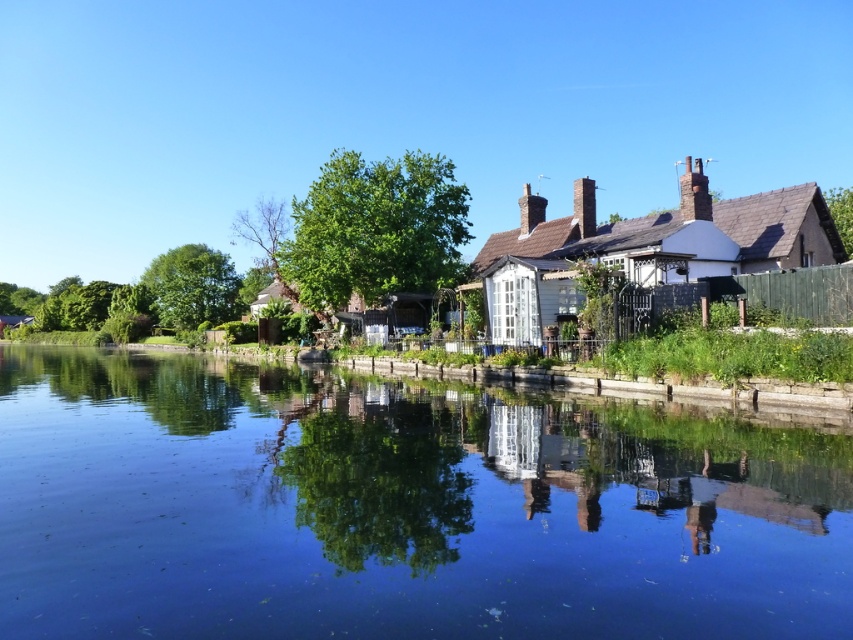
You are standing at the riverside and see the green leafy tree at center and the green leafy tree at left. Which tree is closer to you?

The green leafy tree at center is closer to you because it is positioned over the green leafy tree at left, indicating it is in front.

From the picture: You are standing in the middle of the riverside and see the green leafy tree at center and the green leafy tree at left. Which tree is closer to your right side?

The green leafy tree at center is closer to your right side because it is positioned to the right of the green leafy tree at left.

You are a photographer trying to capture the reflection of the traditional house in the transparent blue water at center. Based on the scene description, where should you position your camera to ensure the reflection is fully visible in the water?

The transparent blue water at center is located at point (x=399, y=508). To capture the reflection of the traditional house, position the camera directly above this point to ensure the reflection is fully visible in the water.